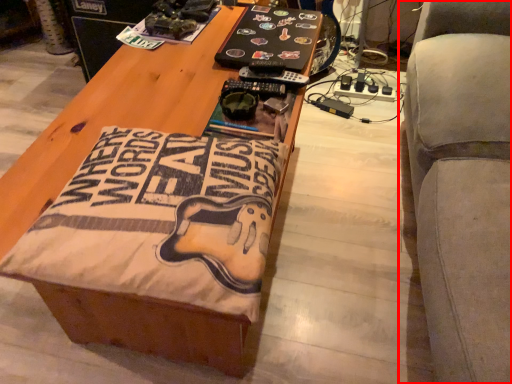
Question: From the image's perspective, where is furniture (annotated by the red box) located relative to table?

Choices:
 (A) below
 (B) above

Answer: (B)